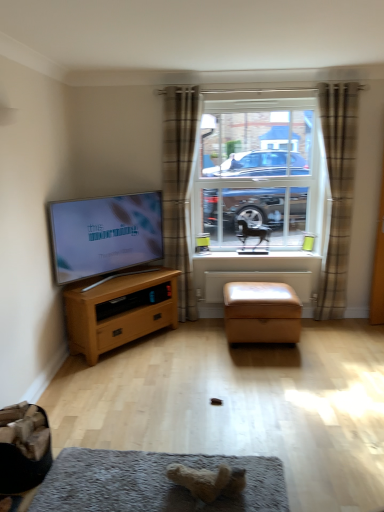
Find the location of a particular element. The height and width of the screenshot is (512, 384). vacant area that is situated to the right of satin tan ottoman at center is located at coordinates (336, 342).